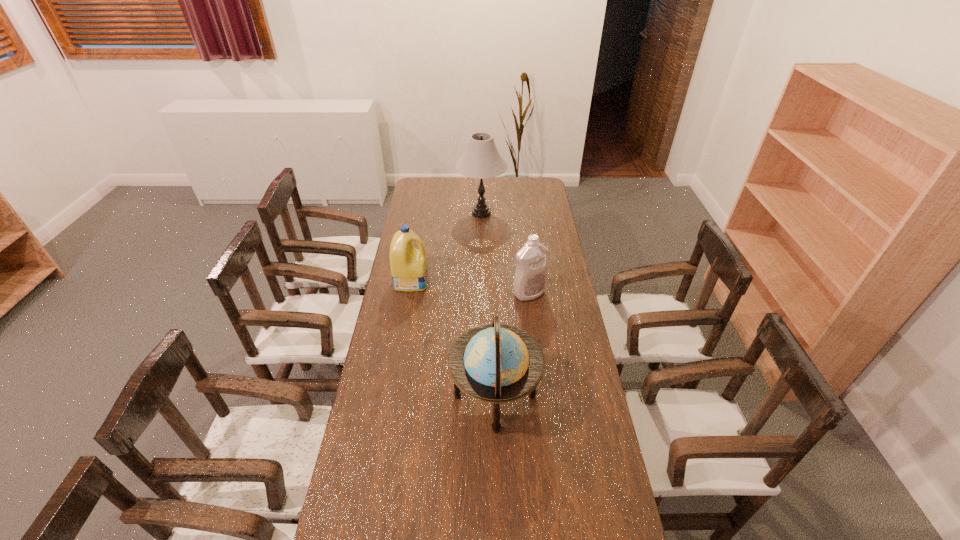
The width and height of the screenshot is (960, 540). Identify the location of the farthest object. (481, 160).

Locate an element on the screen. Image resolution: width=960 pixels, height=540 pixels. lamp is located at coordinates (481, 160).

You are a GUI agent. You are given a task and a screenshot of the screen. Output one action in this format:
    pyautogui.click(x=<x>, y=<y>)
    Task: Click on the globe
    This screenshot has height=540, width=960.
    Given the screenshot: What is the action you would take?
    pyautogui.click(x=496, y=356)

I want to click on the right detergent, so click(x=530, y=279).

This screenshot has width=960, height=540. I want to click on the leftmost object, so click(409, 268).

You are a GUI agent. You are given a task and a screenshot of the screen. Output one action in this format:
    pyautogui.click(x=<x>, y=<y>)
    Task: Click on the free space located 0.120m on the right of the tallest object
    This screenshot has width=960, height=540.
    Given the screenshot: What is the action you would take?
    pyautogui.click(x=528, y=213)

Identify the location of vacant area located on the surface of the globe. (430, 396).

Identify the location of free space located 0.280m on the surface of the globe. (x=368, y=396).

Image resolution: width=960 pixels, height=540 pixels. I want to click on vacant space situated on the surface of the globe, so click(427, 396).

What are the coordinates of `vacant space situated 0.340m on the front of the right detergent` in the screenshot? It's located at (539, 369).